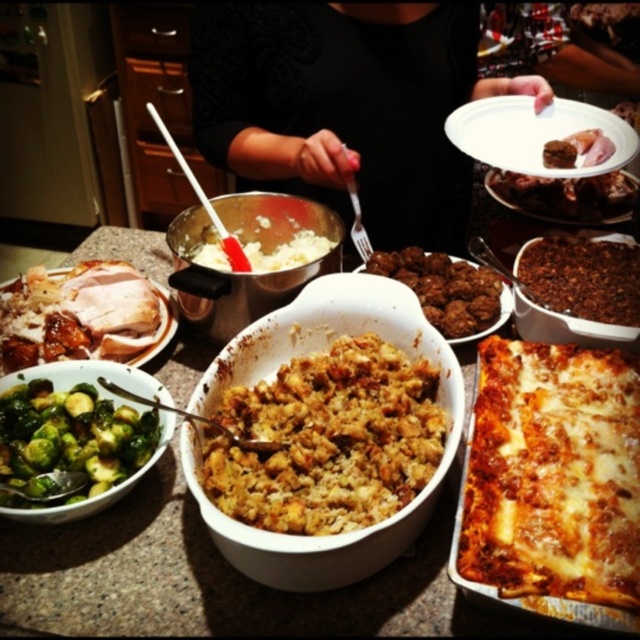
You are a guest at a dinner party and see the dark chocolate cake at center and the brown crispy skin at center on the table. Which item is located lower in the arrangement?

The dark chocolate cake at center is located lower than the brown crispy skin at center.

You are a guest at a dinner party and see the dark chocolate cake at center and the brown crispy skin at center on the table. Which one takes up more space on the table?

The dark chocolate cake at center is larger in size than the brown crispy skin at center, so it takes up more space on the table.

You are a delivery person standing at the point marked by the coordinate point at (538,244). You need to place a small package on the countertop without moving any of the dishes. Is there enough space between the large white casserole dish and the rectangular baking dish to place the package?

The distance between the large white casserole dish and the rectangular baking dish is 1.01 meters, so there is sufficient space to place the small package between them.